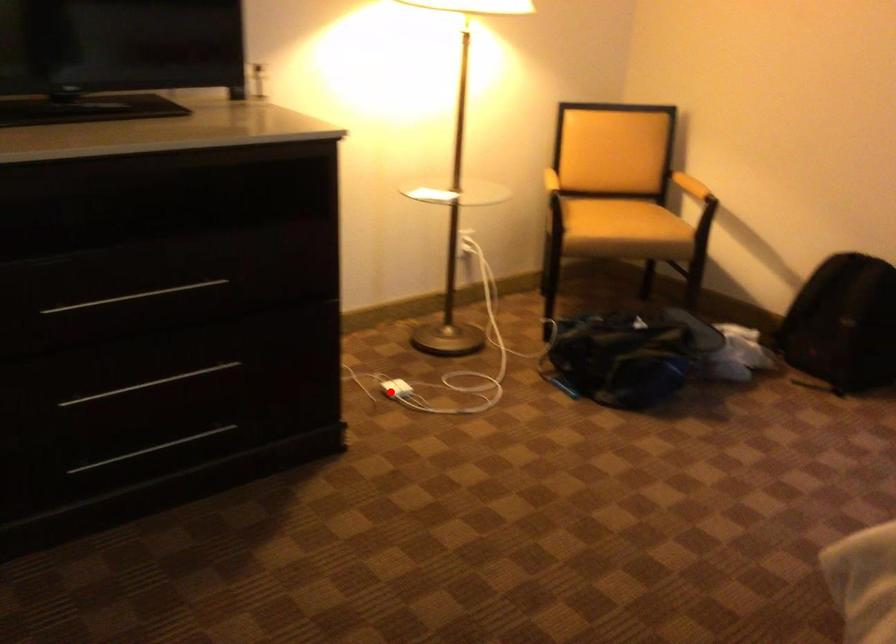
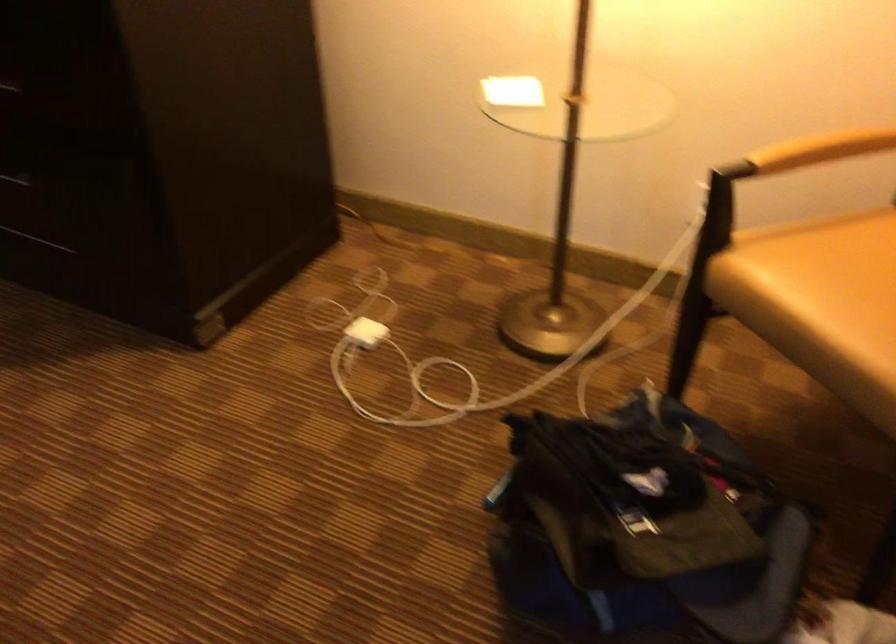
Question: A red point is marked in image1. In image2, is the corresponding 3D point closer to the camera or farther? Reply with the corresponding letter.

Choices:
 (A) The corresponding 3D point is closer.
 (B) The corresponding 3D point is farther.

Answer: (A)